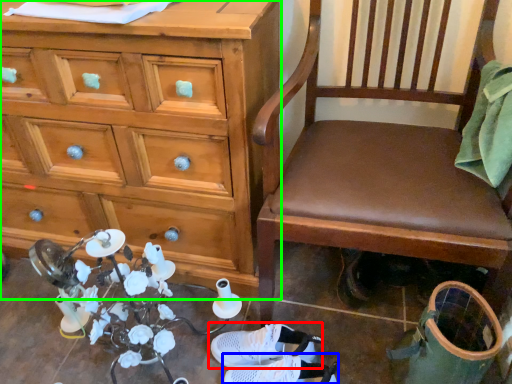
Question: Considering the real-world distances, which object is farthest from footwear (highlighted by a red box)? footwear (highlighted by a blue box) or chest of drawers (highlighted by a green box)?

Choices:
 (A) footwear
 (B) chest of drawers

Answer: (B)